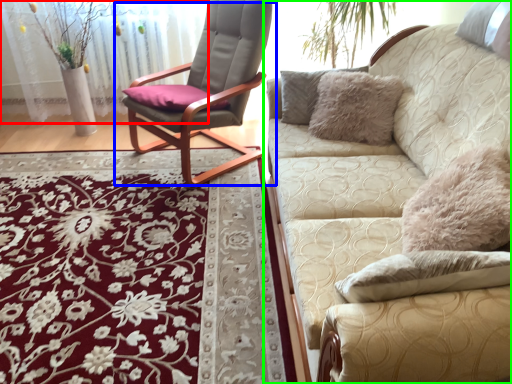
Question: Estimate the real-world distances between objects in this image. Which object is farther from glass door (highlighted by a red box), chair (highlighted by a blue box) or studio couch (highlighted by a green box)?

Choices:
 (A) chair
 (B) studio couch

Answer: (B)